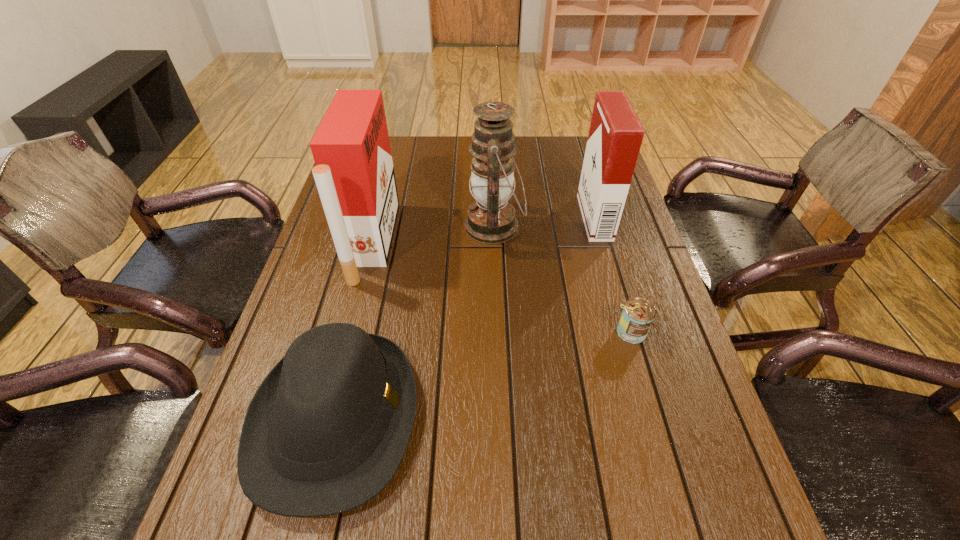
Image resolution: width=960 pixels, height=540 pixels. In order to click on free space located on the front-facing side of the fedora in this screenshot , I will do `click(479, 418)`.

I want to click on vacant space located on the front of the can, so click(x=679, y=498).

At what (x,y) coordinates should I click in order to perform the action: click on cigarette case located at the left edge. Please return your answer as a coordinate pair (x, y). The image size is (960, 540). Looking at the image, I should click on (354, 174).

Where is `fedora positioned at the left edge`? The width and height of the screenshot is (960, 540). fedora positioned at the left edge is located at coordinates (325, 432).

Image resolution: width=960 pixels, height=540 pixels. What are the coordinates of `cigarette_case that is positioned at the right edge` in the screenshot? It's located at (615, 136).

This screenshot has width=960, height=540. I want to click on can positioned at the right edge, so click(x=638, y=314).

Identify the location of vacant region at the left edge of the desktop. (310, 297).

In the image, there is a desktop. Where is `vacant space at the right edge`? The image size is (960, 540). vacant space at the right edge is located at coordinates (675, 378).

You are a GUI agent. You are given a task and a screenshot of the screen. Output one action in this format:
    pyautogui.click(x=<x>, y=<y>)
    Task: Click on the free space between the fedora and the lantern
    This screenshot has height=540, width=960.
    Given the screenshot: What is the action you would take?
    pyautogui.click(x=415, y=322)

This screenshot has height=540, width=960. I want to click on free space between the third object from left to right and the shortest object, so click(x=563, y=280).